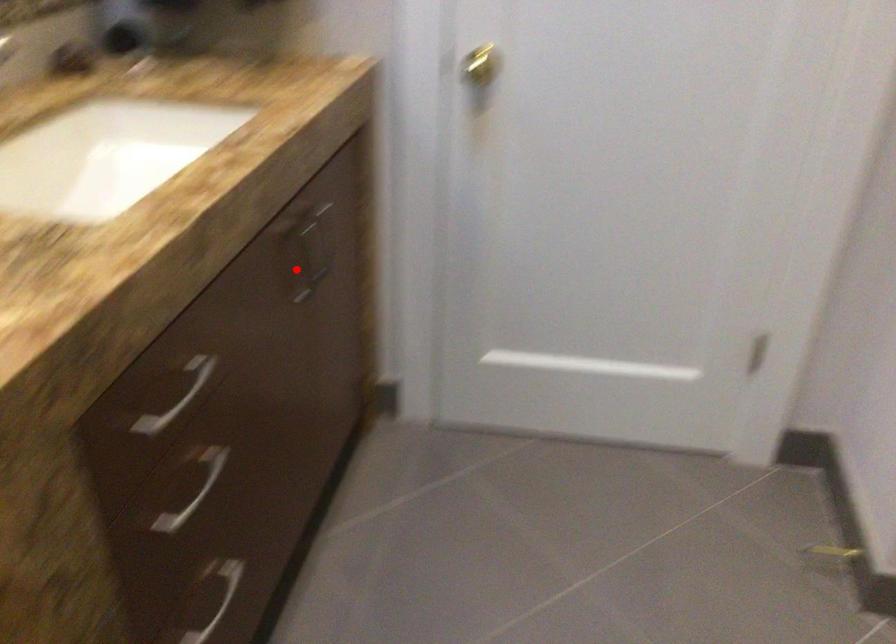
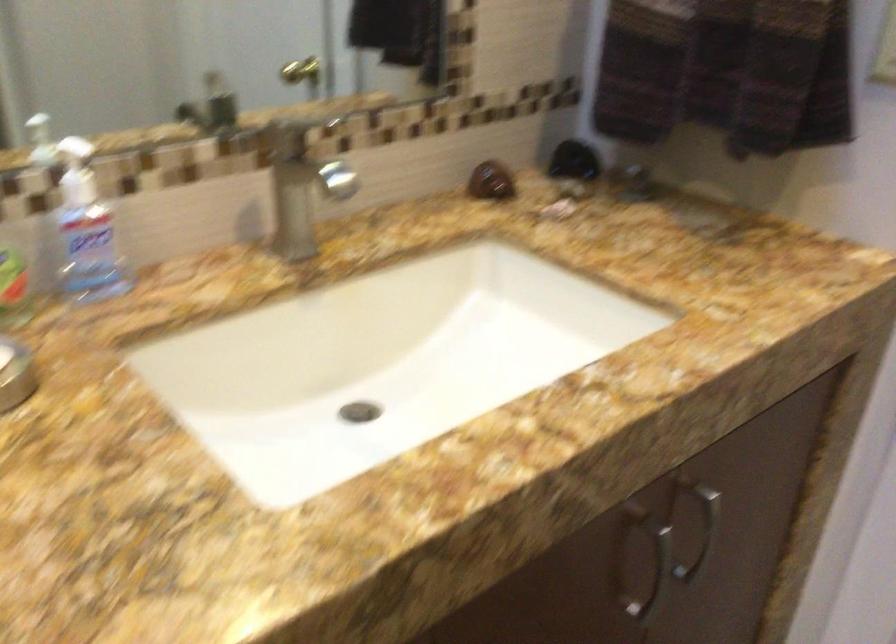
Question: A red point is marked in image1. In image2, is the corresponding 3D point closer to the camera or farther? Reply with the corresponding letter.

Choices:
 (A) The corresponding 3D point is closer.
 (B) The corresponding 3D point is farther.

Answer: (A)